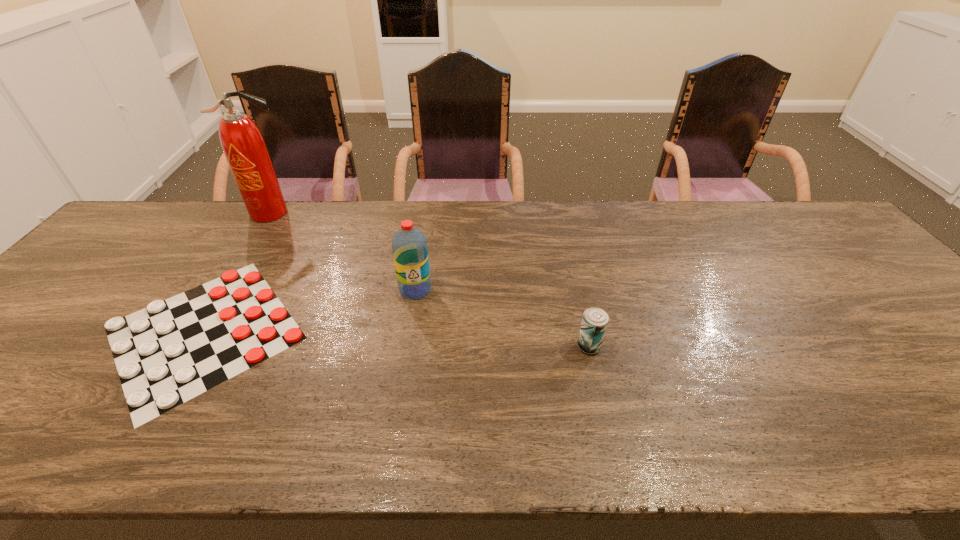
This screenshot has width=960, height=540. In order to click on fire extinguisher in this screenshot , I will do `click(244, 147)`.

What are the coordinates of `the farthest object` in the screenshot? It's located at (244, 147).

What are the coordinates of `water bottle` in the screenshot? It's located at (409, 245).

Locate an element on the screen. the second tallest object is located at coordinates (409, 245).

The height and width of the screenshot is (540, 960). I want to click on the third tallest object, so (x=595, y=320).

Where is `the rightmost object`? This screenshot has height=540, width=960. the rightmost object is located at coordinates (595, 320).

This screenshot has height=540, width=960. Find the location of `checkerboard`. checkerboard is located at coordinates (184, 348).

In order to click on blank space located 0.400m on the front of the tallest object in this screenshot , I will do `click(207, 315)`.

This screenshot has width=960, height=540. I want to click on free spot located 0.280m on the front label of the second tallest object, so click(398, 394).

I want to click on vacant space located 0.120m on the left of the beer can, so click(526, 346).